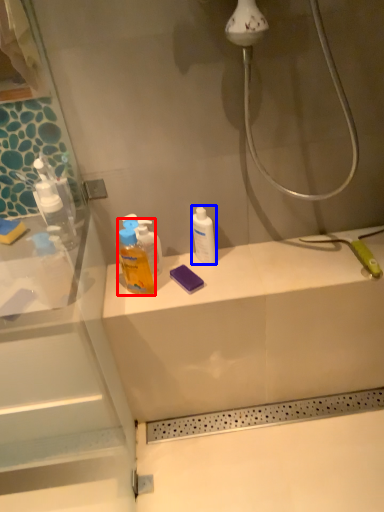
Question: Which object appears farthest to the camera in this image, cleaning product (highlighted by a red box) or mouthwash (highlighted by a blue box)?

Choices:
 (A) cleaning product
 (B) mouthwash

Answer: (B)